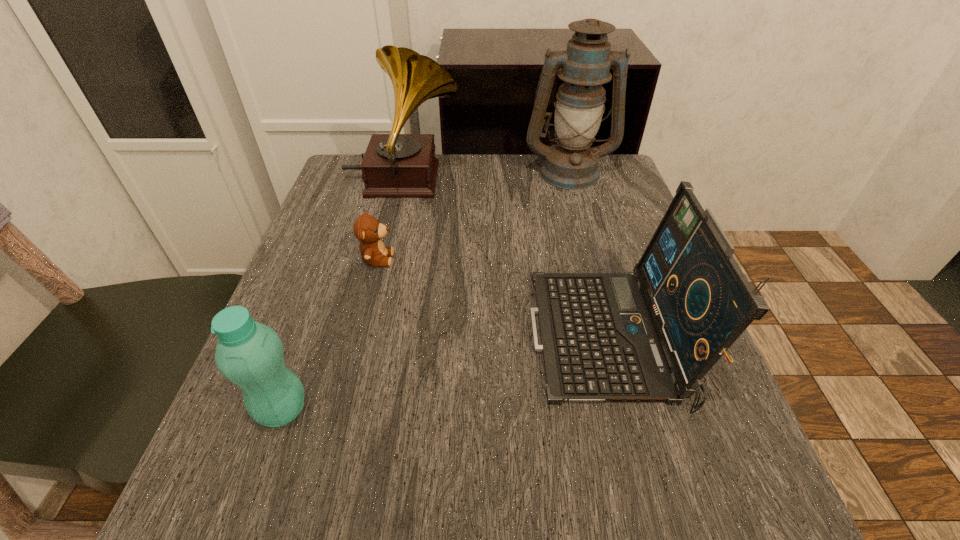
I want to click on object at the far left corner, so click(394, 165).

This screenshot has width=960, height=540. Find the location of `object that is positioned at the far right corner`. object that is positioned at the far right corner is located at coordinates (585, 65).

You are a GUI agent. You are given a task and a screenshot of the screen. Output one action in this format:
    pyautogui.click(x=<x>, y=<y>)
    Task: Click on the vacant space at the near edge of the desktop
    The image size is (960, 540).
    Given the screenshot: What is the action you would take?
    pyautogui.click(x=501, y=523)

The width and height of the screenshot is (960, 540). I want to click on free space at the left edge, so click(x=332, y=210).

Identify the location of vacant space at the right edge of the desktop. The image size is (960, 540). (634, 225).

Locate an element on the screen. This screenshot has height=540, width=960. vacant space at the near left corner of the desktop is located at coordinates (260, 511).

I want to click on vacant space at the far right corner, so click(x=622, y=201).

Where is `vacant area between the phonograph record and the bottle`? This screenshot has width=960, height=540. vacant area between the phonograph record and the bottle is located at coordinates (343, 295).

The image size is (960, 540). Find the location of `unoccupied position between the phonograph record and the teddy bear`. unoccupied position between the phonograph record and the teddy bear is located at coordinates (390, 220).

What are the coordinates of `free space between the laptop computer and the oil lamp` in the screenshot? It's located at (588, 255).